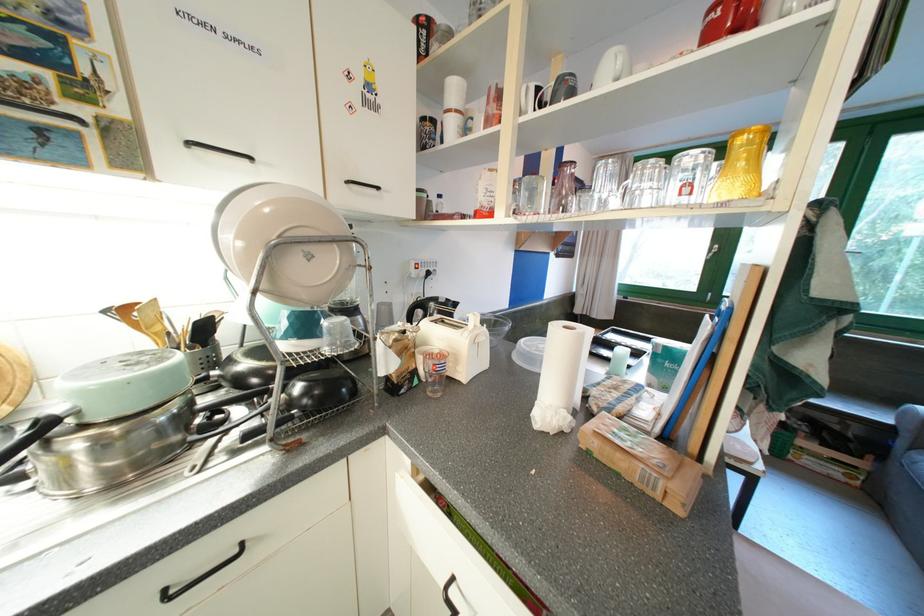
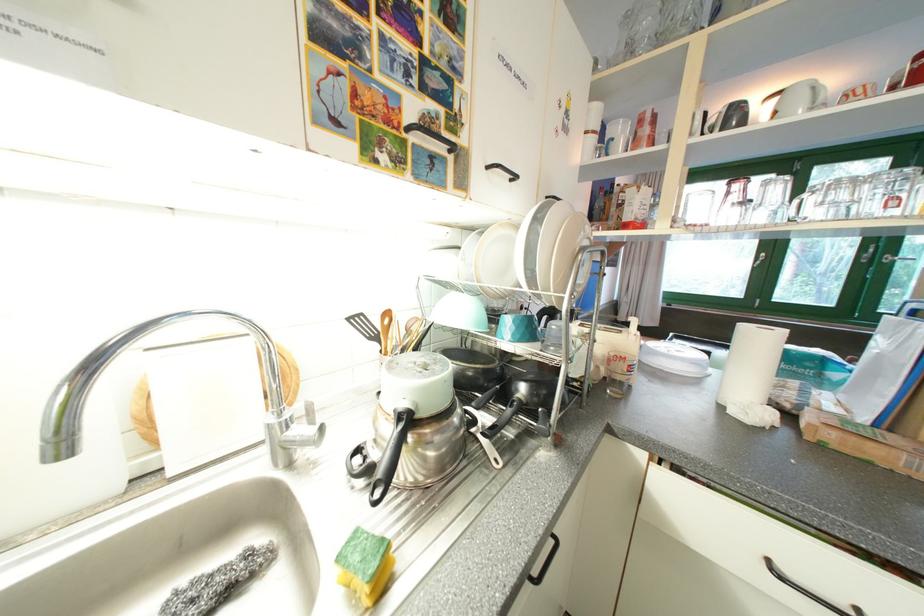
In the second image, find the point that corresponds to (x=244, y=554) in the first image.

(560, 541)